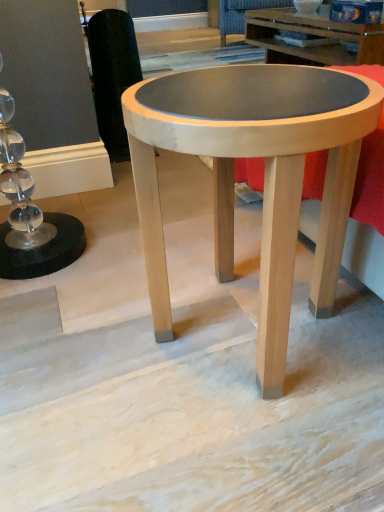
What are the coordinates of `vacant space underneath matte wood coffee table at center (from a real-world perspective)` in the screenshot? It's located at coord(233,334).